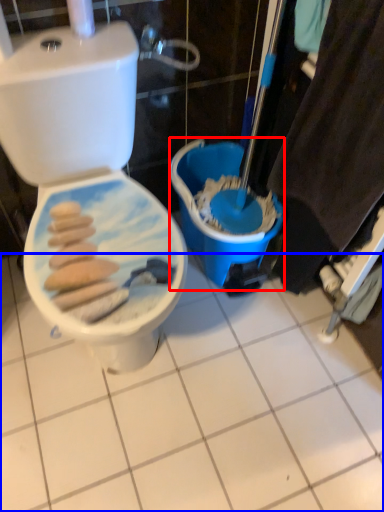
Question: Among these objects, which one is nearest to the camera, potty (highlighted by a red box) or ceramic tile (highlighted by a blue box)?

Choices:
 (A) potty
 (B) ceramic tile

Answer: (B)